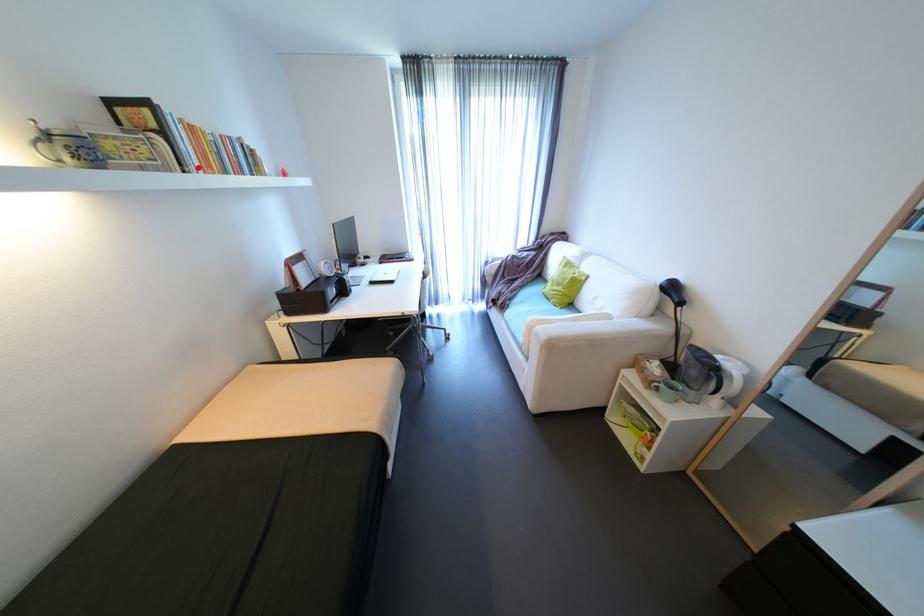
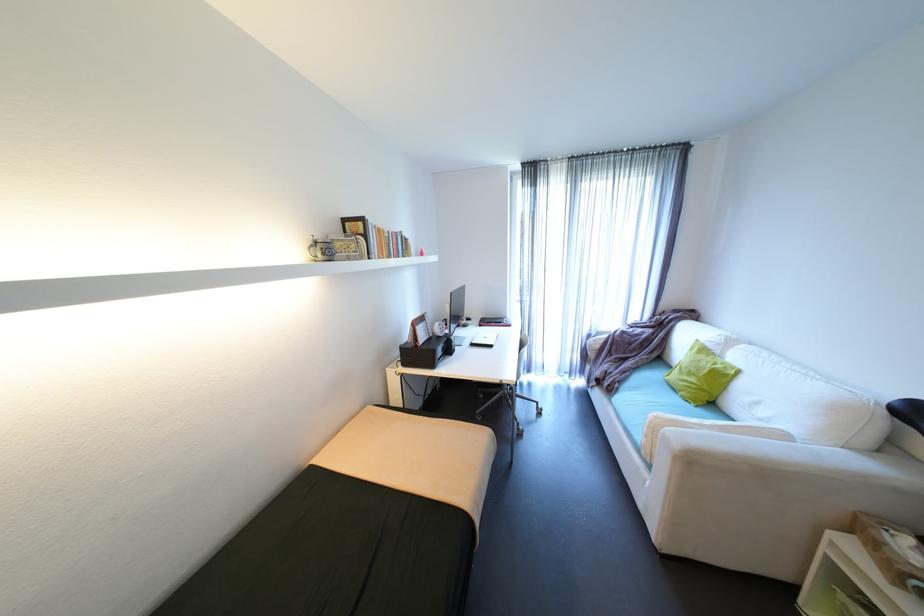
Find the pixel in the second image that matches the highlighted location in the first image.

(380, 254)